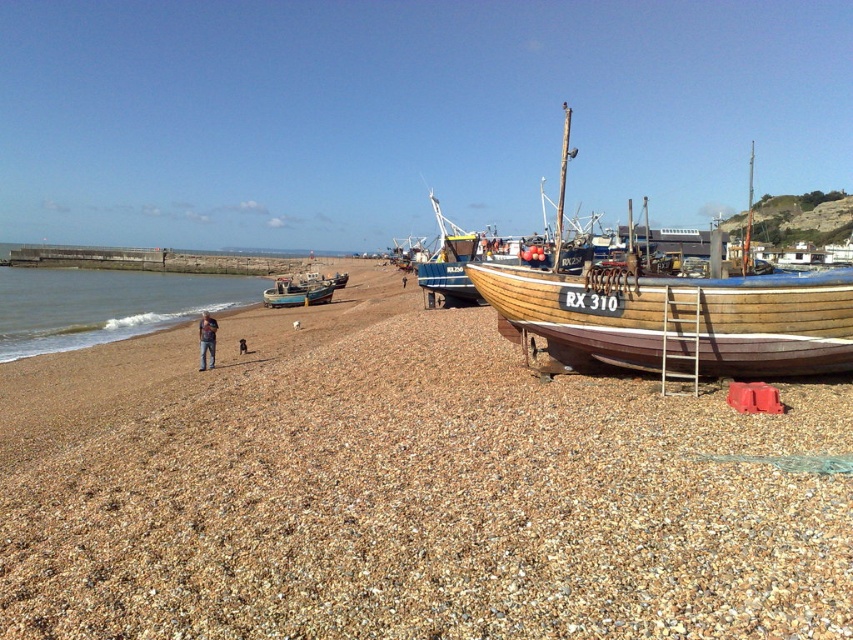
Question: Can you confirm if brown gravel at center is positioned to the right of blue wooden boat at center?

Choices:
 (A) no
 (B) yes

Answer: (B)

Question: Which object is farther from the camera taking this photo?

Choices:
 (A) clear blue water at lower left
 (B) blue wooden boat at center

Answer: (B)

Question: Which point is farther to the camera?

Choices:
 (A) (91, 330)
 (B) (807, 298)
 (C) (486, 593)
 (D) (204, 320)

Answer: (A)

Question: Is clear blue water at lower left behind denim pants at lower left?

Choices:
 (A) yes
 (B) no

Answer: (A)

Question: Which object appears closest to the camera in this image?

Choices:
 (A) brown gravel at center
 (B) denim pants at lower left
 (C) clear blue water at lower left
 (D) blue wooden boat at center

Answer: (A)

Question: Does brown gravel at center have a larger size compared to wooden boat at right?

Choices:
 (A) no
 (B) yes

Answer: (A)